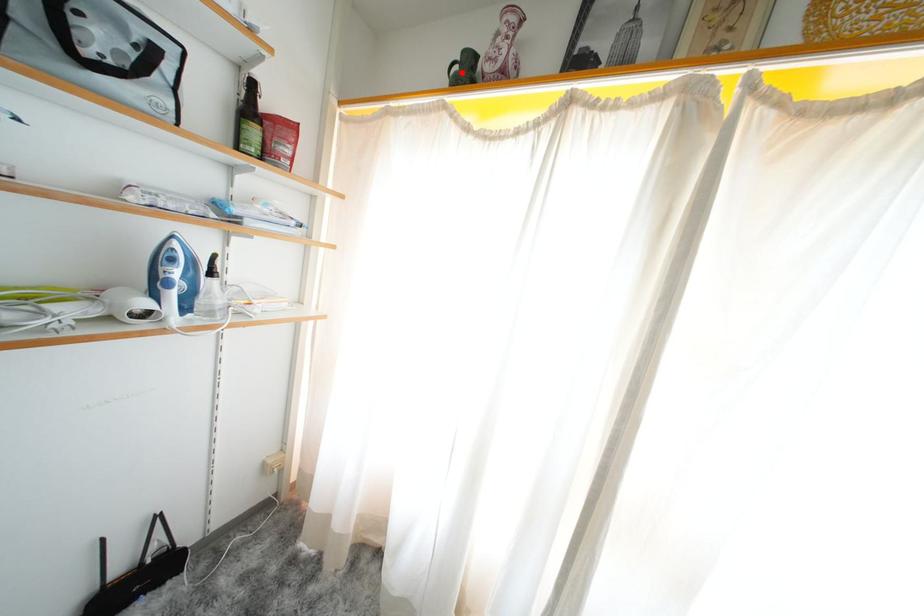
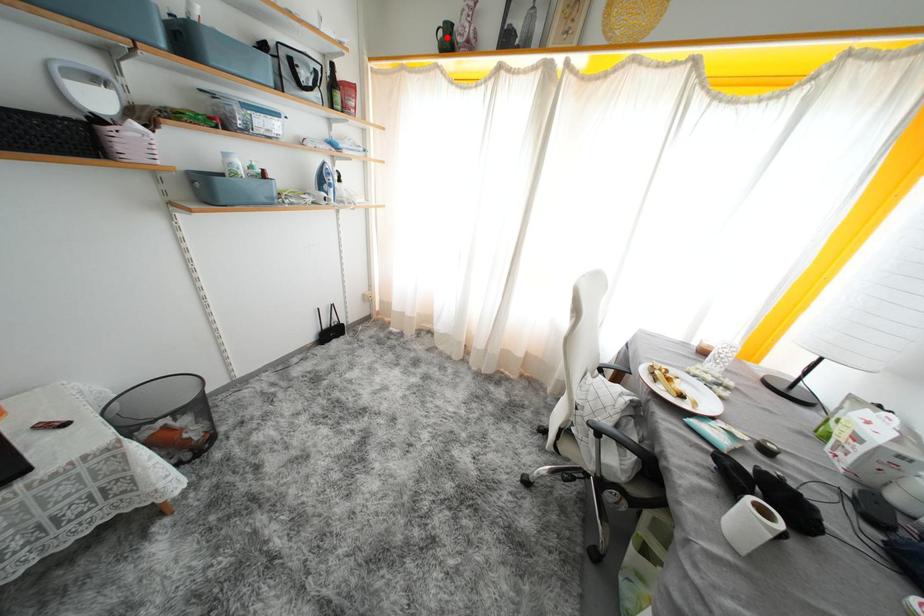
I am providing you with two images of the same scene from different viewpoints. A red point is marked on the first image and another point is marked on the second image. Does the point marked in image1 correspond to the same location as the one in image2?

Yes